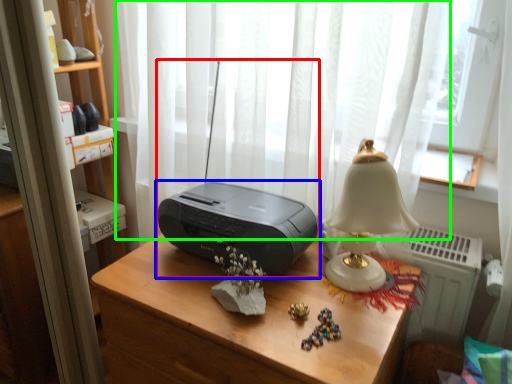
Question: Considering the real-world distances, which object is closest to stereo (highlighted by a red box)? printer (highlighted by a blue box) or curtain (highlighted by a green box).

Choices:
 (A) printer
 (B) curtain

Answer: (A)